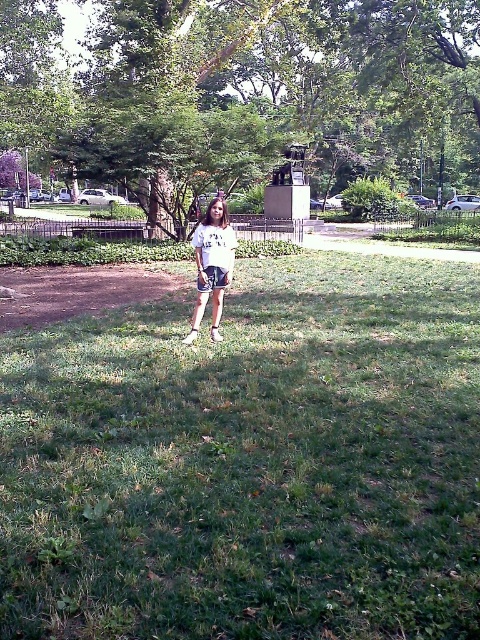
Question: Which of the following is the farthest from the observer?

Choices:
 (A) green grassy field at center
 (B) white cotton shirt at center

Answer: (B)

Question: In this image, where is green grassy field at center located relative to white cotton shirt at center?

Choices:
 (A) left
 (B) right

Answer: (B)

Question: Among these points, which one is farthest from the camera?

Choices:
 (A) (212, 269)
 (B) (123, 566)

Answer: (A)

Question: Which point is closer to the camera?

Choices:
 (A) green grassy field at center
 (B) white cotton shirt at center

Answer: (A)

Question: Does green grassy field at center appear on the left side of white cotton shirt at center?

Choices:
 (A) no
 (B) yes

Answer: (A)

Question: Can you confirm if green grassy field at center is thinner than white cotton shirt at center?

Choices:
 (A) yes
 (B) no

Answer: (B)